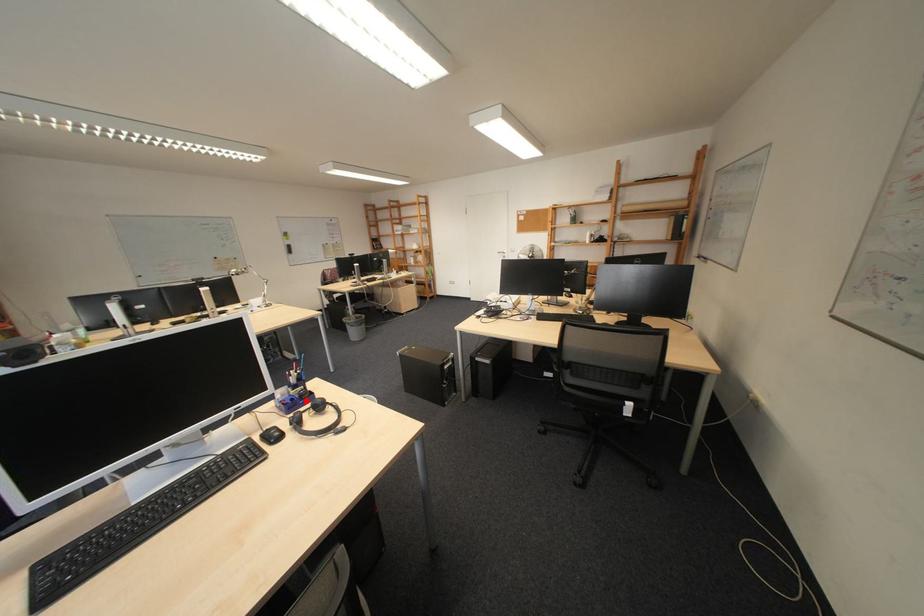
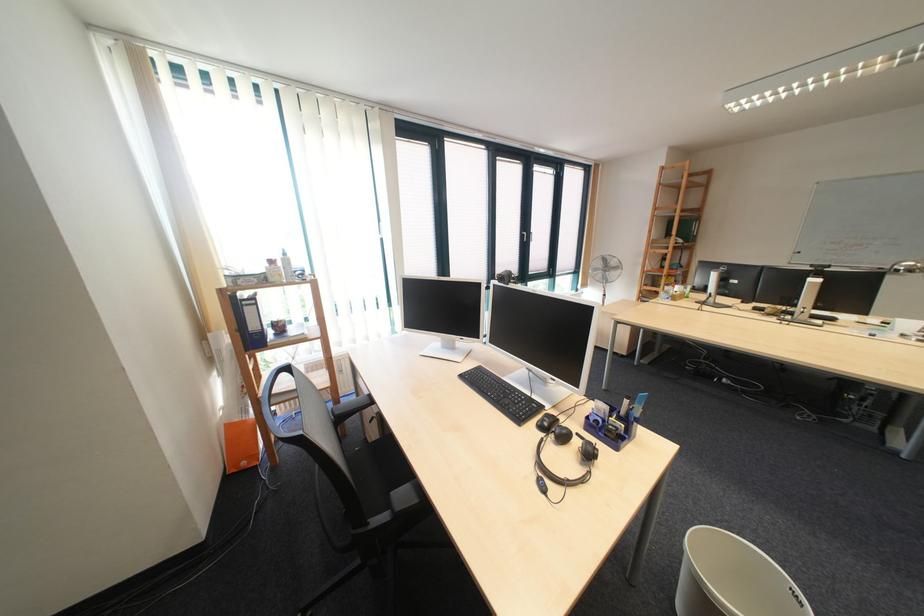
Find the pixel in the second image that matches the highlighted location in the first image.

(611, 423)